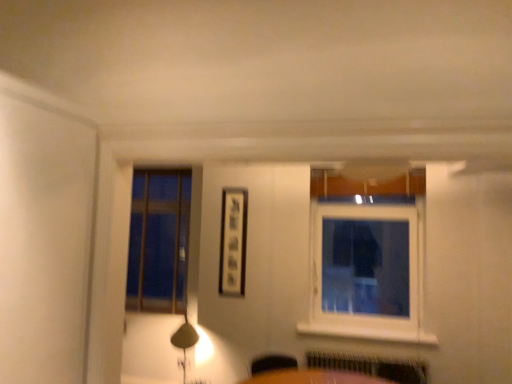
Question: Is white painted wood at lower center to the left of white plastic window at upper right from the viewer's perspective?

Choices:
 (A) no
 (B) yes

Answer: (B)

Question: Considering the relative sizes of white painted wood at lower center and white plastic window at upper right in the image provided, is white painted wood at lower center thinner than white plastic window at upper right?

Choices:
 (A) no
 (B) yes

Answer: (A)

Question: Can you confirm if white painted wood at lower center is bigger than white plastic window at upper right?

Choices:
 (A) yes
 (B) no

Answer: (B)

Question: Could you tell me if white painted wood at lower center is turned towards white plastic window at upper right?

Choices:
 (A) yes
 (B) no

Answer: (B)

Question: Is the surface of white painted wood at lower center in direct contact with white plastic window at upper right?

Choices:
 (A) no
 (B) yes

Answer: (A)

Question: Is matte gold table lamp at lower left spatially inside matte black picture frame at center, or outside of it?

Choices:
 (A) outside
 (B) inside

Answer: (A)

Question: From a real-world perspective, is matte gold table lamp at lower left above or below matte black picture frame at center?

Choices:
 (A) above
 (B) below

Answer: (B)

Question: Based on their sizes in the image, would you say matte gold table lamp at lower left is bigger or smaller than matte black picture frame at center?

Choices:
 (A) small
 (B) big

Answer: (B)

Question: Would you say matte gold table lamp at lower left is to the left or to the right of matte black picture frame at center in the picture?

Choices:
 (A) left
 (B) right

Answer: (A)

Question: Would you say metallic silver radiator at lower center is inside or outside matte gold table lamp at lower left?

Choices:
 (A) outside
 (B) inside

Answer: (A)

Question: In terms of size, does metallic silver radiator at lower center appear bigger or smaller than matte gold table lamp at lower left?

Choices:
 (A) small
 (B) big

Answer: (A)

Question: From a real-world perspective, is metallic silver radiator at lower center physically located above or below matte gold table lamp at lower left?

Choices:
 (A) above
 (B) below

Answer: (B)

Question: From their relative heights in the image, would you say metallic silver radiator at lower center is taller or shorter than matte gold table lamp at lower left?

Choices:
 (A) short
 (B) tall

Answer: (A)

Question: Based on their sizes in the image, would you say white plastic window at upper right is bigger or smaller than matte black picture frame at center?

Choices:
 (A) big
 (B) small

Answer: (A)

Question: Choose the correct answer: Is white plastic window at upper right inside matte black picture frame at center or outside it?

Choices:
 (A) inside
 (B) outside

Answer: (B)